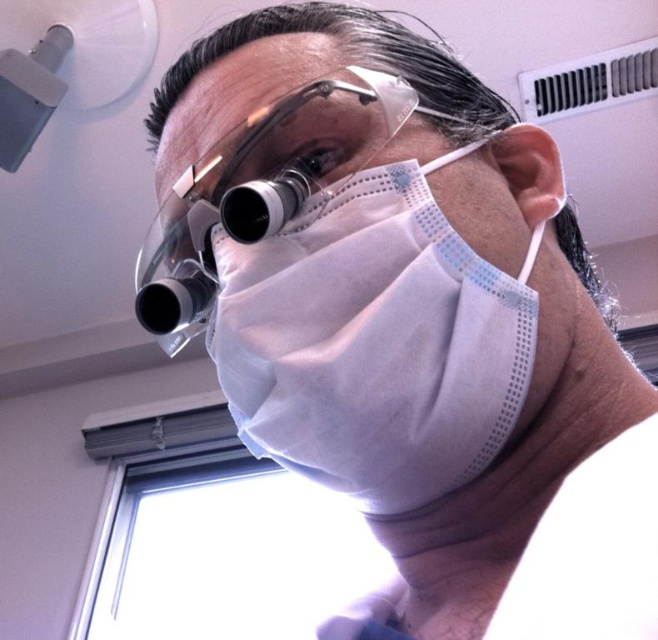
Which is behind, point (368, 204) or point (307, 168)?

The point (307, 168) is more distant.

Does white matte mask at center have a lesser width compared to transparent plastic goggles at center?

Correct, white matte mask at center's width is less than transparent plastic goggles at center's.

Where is `white matte mask at center`? white matte mask at center is located at coordinates (372, 340).

Image resolution: width=658 pixels, height=640 pixels. Find the location of `white matte mask at center`. white matte mask at center is located at coordinates (372, 340).